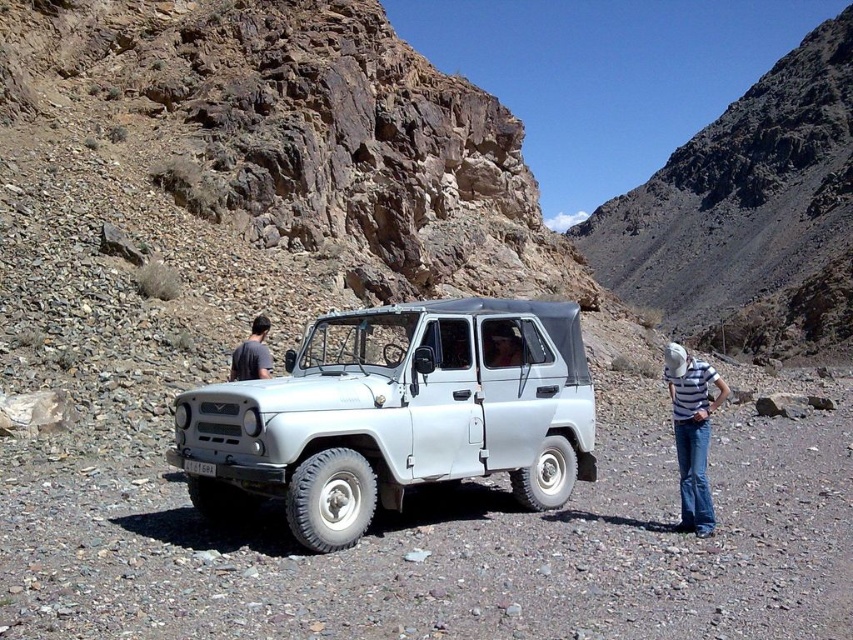
Question: Is striped fabric shirt at lower right wider than gray cotton shirt at center?

Choices:
 (A) no
 (B) yes

Answer: (B)

Question: Is rugged stone hillside at upper right smaller than gray cotton shirt at center?

Choices:
 (A) no
 (B) yes

Answer: (A)

Question: Estimate the real-world distances between objects in this image. Which object is closer to the rugged stone hillside at upper right?

Choices:
 (A) white matte jeep at center
 (B) matte gray vehicle at center
 (C) gray cotton shirt at center
 (D) striped fabric shirt at lower right

Answer: (A)

Question: Can you confirm if rugged stone hillside at upper right is positioned to the right of gray cotton shirt at center?

Choices:
 (A) no
 (B) yes

Answer: (B)

Question: Which point appears closest to the camera in this image?

Choices:
 (A) (521, 358)
 (B) (271, 493)

Answer: (B)

Question: Which of the following is the farthest from the observer?

Choices:
 (A) rugged stone hillside at upper right
 (B) white matte jeep at center
 (C) matte gray vehicle at center

Answer: (A)